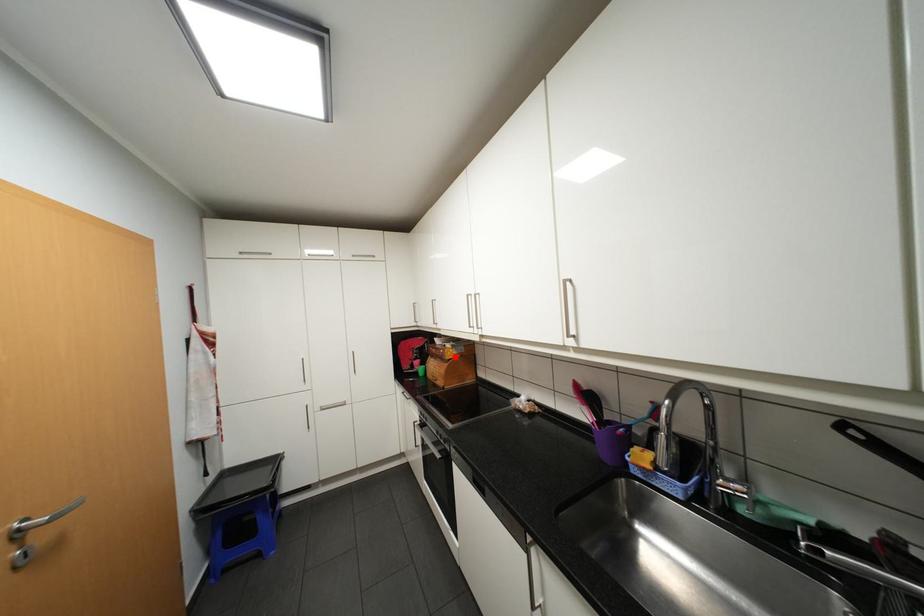
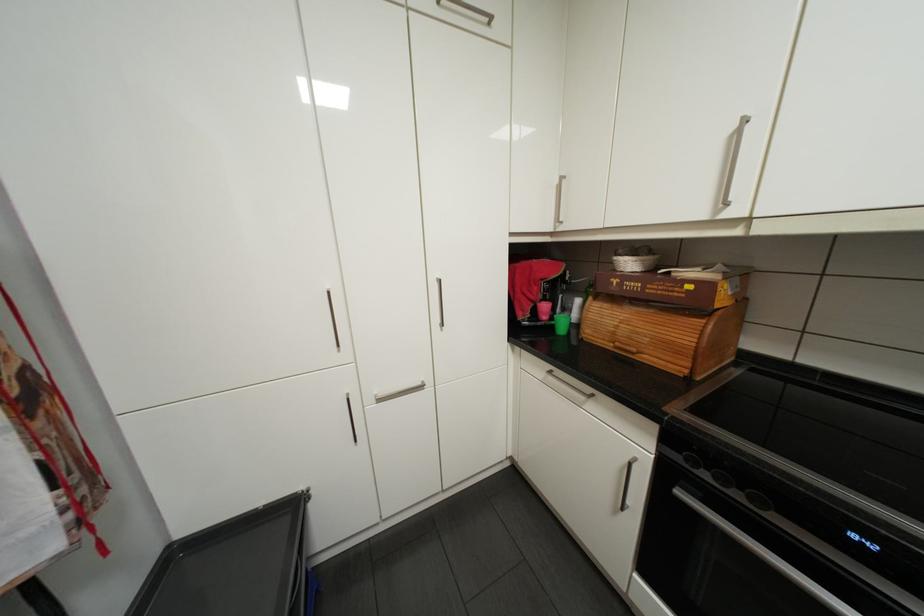
Where in the second image is the point corresponding to the highlighted location from the first image?

(725, 305)